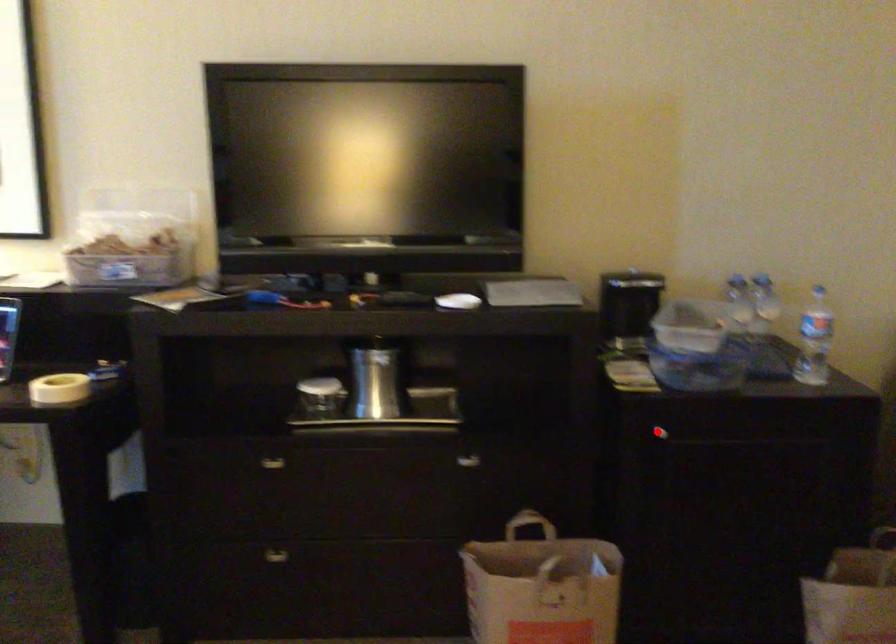
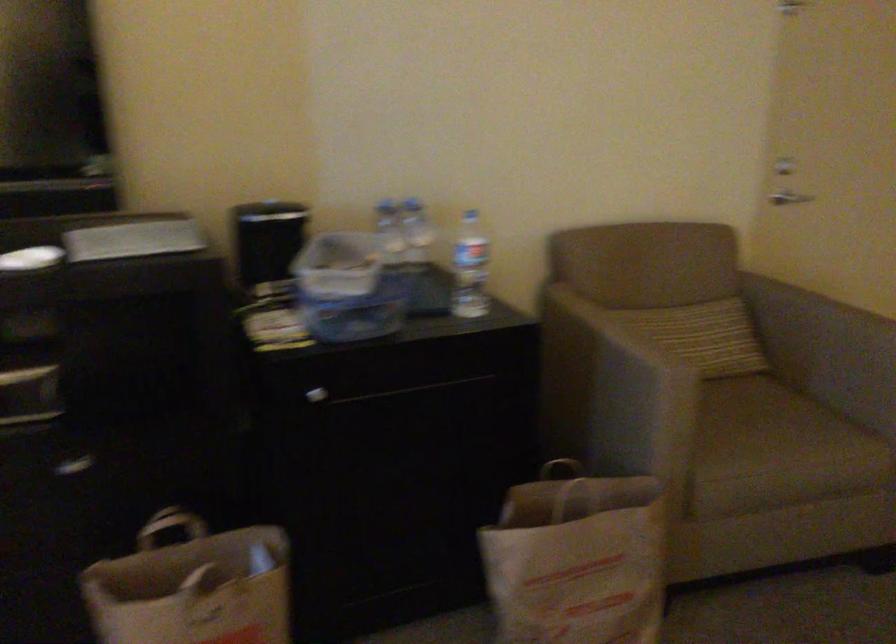
Question: A red point is marked in image1. In image2, is the corresponding 3D point closer to the camera or farther? Reply with the corresponding letter.

Choices:
 (A) The corresponding 3D point is closer.
 (B) The corresponding 3D point is farther.

Answer: (A)